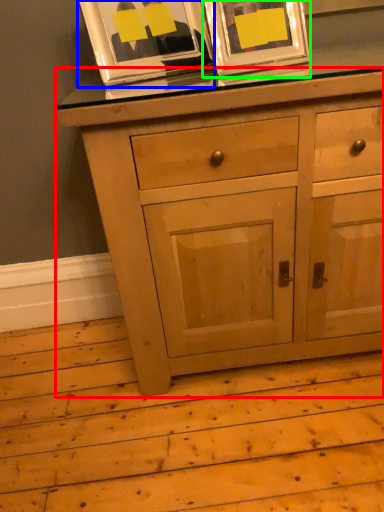
Question: Which is nearer to the chest of drawers (highlighted by a red box)? picture frame (highlighted by a blue box) or picture frame (highlighted by a green box).

Choices:
 (A) picture frame
 (B) picture frame

Answer: (B)